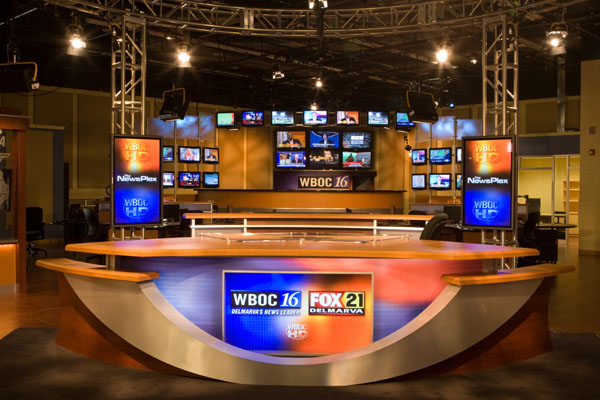
Find the location of `chair`. chair is located at coordinates (425, 211), (35, 229).